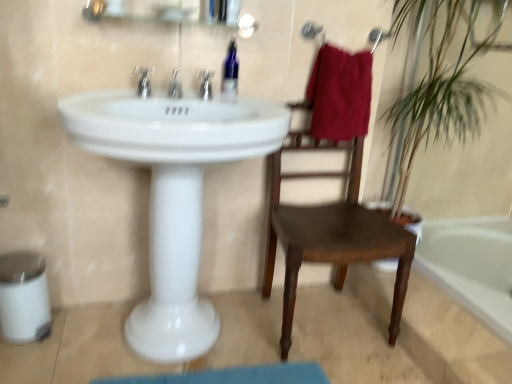
Question: Is metallic glass medicine cabinet at upper center facing towards white glossy sink at center?

Choices:
 (A) yes
 (B) no

Answer: (B)

Question: Considering the relative sizes of metallic glass medicine cabinet at upper center and white glossy sink at center in the image provided, is metallic glass medicine cabinet at upper center bigger than white glossy sink at center?

Choices:
 (A) yes
 (B) no

Answer: (B)

Question: Does metallic glass medicine cabinet at upper center appear on the left side of white glossy sink at center?

Choices:
 (A) no
 (B) yes

Answer: (B)

Question: Is metallic glass medicine cabinet at upper center positioned with its back to white glossy sink at center?

Choices:
 (A) no
 (B) yes

Answer: (A)

Question: Is metallic glass medicine cabinet at upper center to the right of white glossy sink at center from the viewer's perspective?

Choices:
 (A) yes
 (B) no

Answer: (B)

Question: Is white glossy sink at center situated inside metallic glass medicine cabinet at upper center or outside?

Choices:
 (A) outside
 (B) inside

Answer: (A)

Question: Considering the positions of white glossy sink at center and metallic glass medicine cabinet at upper center in the image, is white glossy sink at center taller or shorter than metallic glass medicine cabinet at upper center?

Choices:
 (A) tall
 (B) short

Answer: (A)

Question: Considering their positions, is white glossy sink at center located in front of or behind metallic glass medicine cabinet at upper center?

Choices:
 (A) behind
 (B) front

Answer: (B)

Question: In the image, is white glossy sink at center on the left side or the right side of metallic glass medicine cabinet at upper center?

Choices:
 (A) right
 (B) left

Answer: (A)

Question: Looking at their shapes, would you say burgundy cotton towel at upper right is wider or thinner than white glossy sink at center?

Choices:
 (A) wide
 (B) thin

Answer: (B)

Question: Is burgundy cotton towel at upper right taller or shorter than white glossy sink at center?

Choices:
 (A) tall
 (B) short

Answer: (B)

Question: Looking at the image, does burgundy cotton towel at upper right seem bigger or smaller compared to white glossy sink at center?

Choices:
 (A) big
 (B) small

Answer: (B)

Question: From a real-world perspective, is burgundy cotton towel at upper right above or below white glossy sink at center?

Choices:
 (A) below
 (B) above

Answer: (B)

Question: Is point (477, 91) positioned closer to the camera than point (205, 74)?

Choices:
 (A) closer
 (B) farther

Answer: (B)

Question: Relative to matte silver faucet at center, which is the 3th tap from left to right, is green leafy plant at right in front or behind?

Choices:
 (A) front
 (B) behind

Answer: (A)